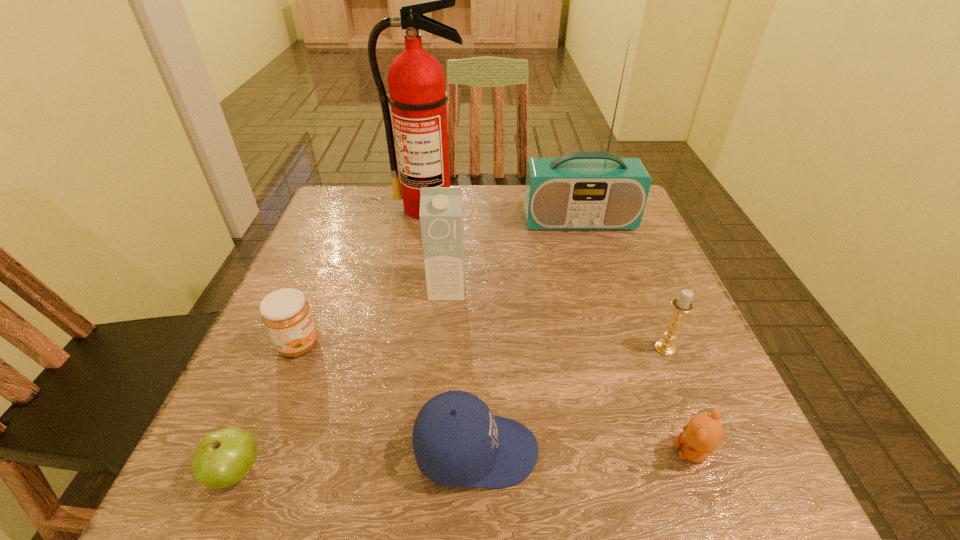
This screenshot has width=960, height=540. In order to click on blank space that satisfies the following two spatial constraints: 1. on the front label of the third tallest object; 2. on the right side of the candle holder in this screenshot , I will do `click(443, 348)`.

Where is `blank area in the image that satisfies the following two spatial constraints: 1. on the front panel of the candle holder; 2. on the left side of the seventh shortest object`? blank area in the image that satisfies the following two spatial constraints: 1. on the front panel of the candle holder; 2. on the left side of the seventh shortest object is located at coordinates (617, 348).